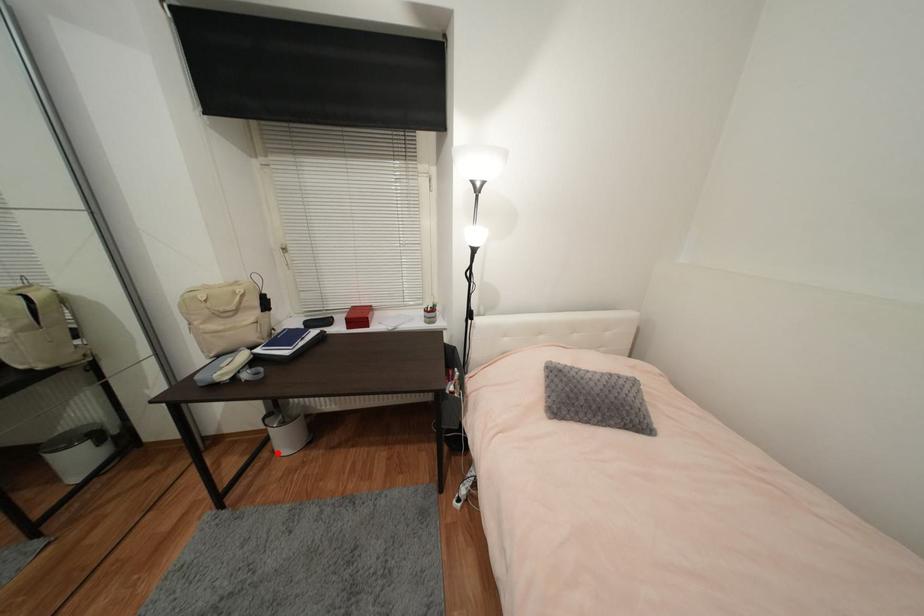
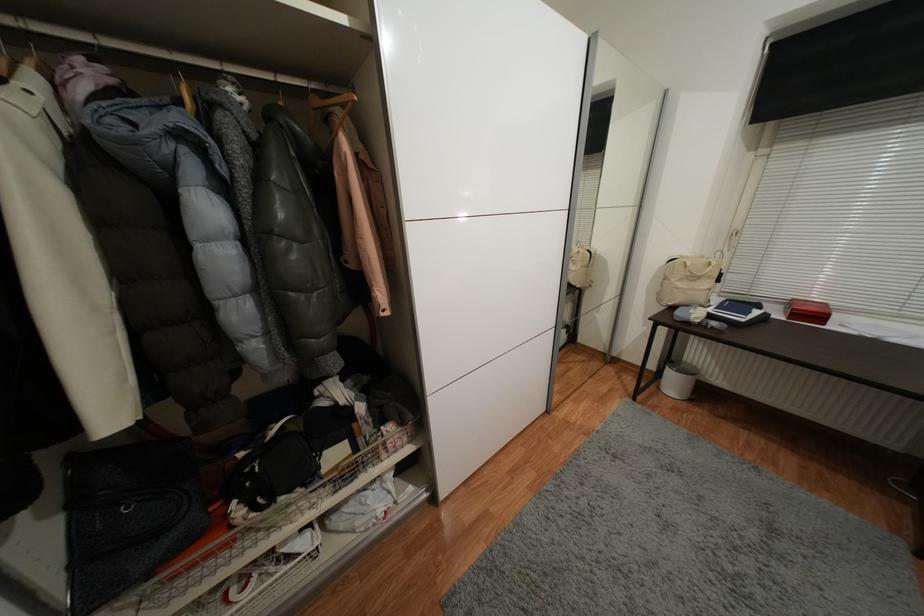
The point at the highlighted location is marked in the first image. Where is the corresponding point in the second image?

(663, 390)